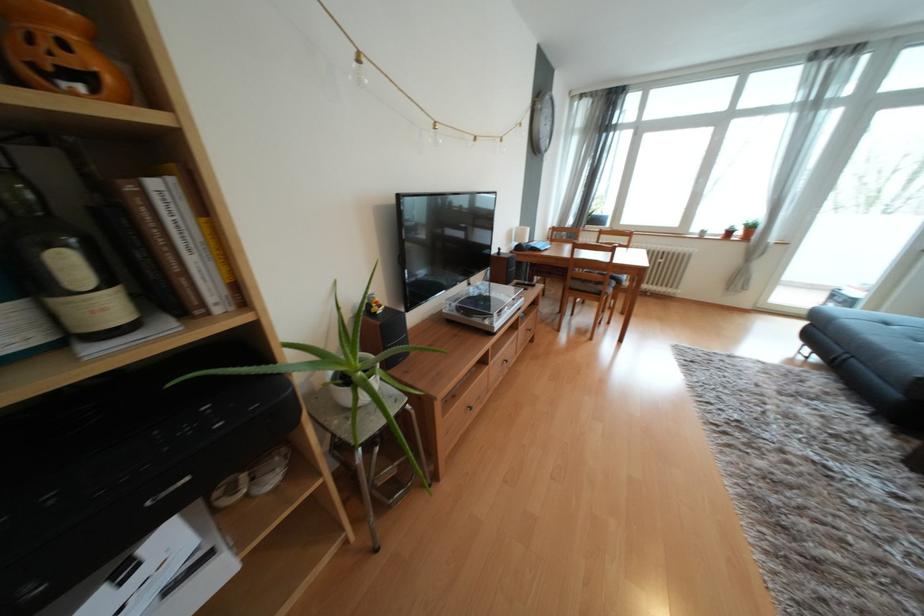
Where would you lift the turntable dust cover? Please return your answer as a coordinate pair (x, y).

(820, 493)